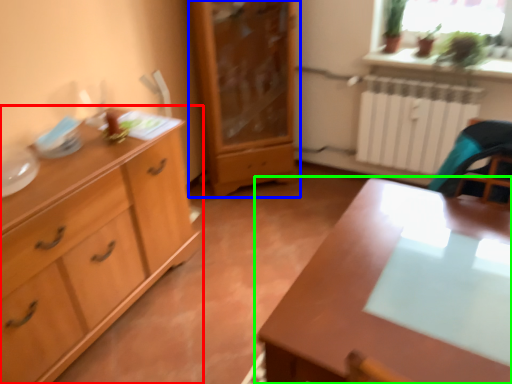
Question: Based on their relative distances, which object is farther from chest of drawers (highlighted by a red box)? Choose from chest of drawers (highlighted by a blue box) and table (highlighted by a green box).

Choices:
 (A) chest of drawers
 (B) table

Answer: (A)